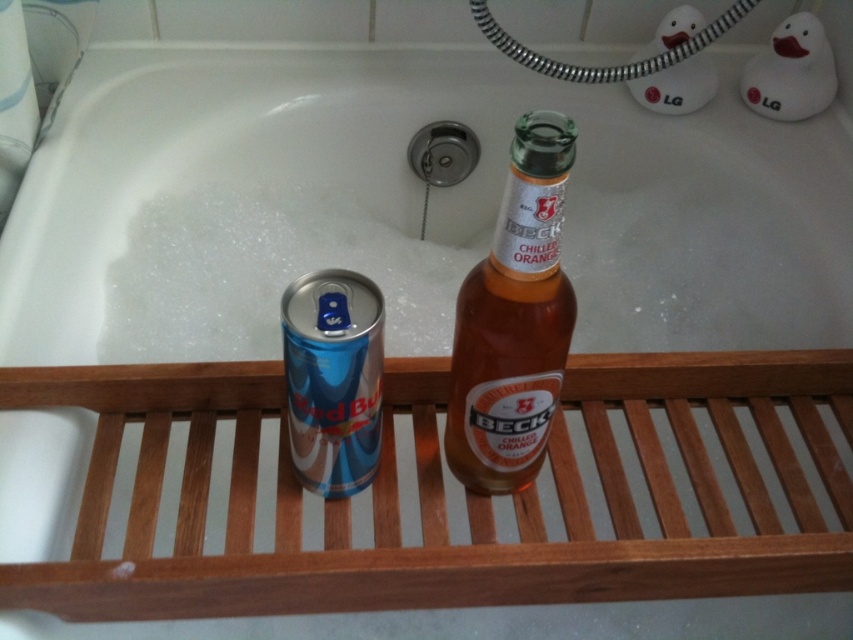
Question: Is white glossy bathtub at upper center positioned behind blue metallic red bull can at left?

Choices:
 (A) no
 (B) yes

Answer: (B)

Question: Considering the relative positions of translucent amber glass bottle at center and blue metallic red bull can at left in the image provided, where is translucent amber glass bottle at center located with respect to blue metallic red bull can at left?

Choices:
 (A) below
 (B) above

Answer: (B)

Question: Does translucent amber glass bottle at center come in front of blue metallic red bull can at left?

Choices:
 (A) no
 (B) yes

Answer: (B)

Question: Which object is the closest to the white glossy bathtub at upper center?

Choices:
 (A) blue metallic red bull can at left
 (B) translucent amber glass bottle at center

Answer: (B)

Question: Estimate the real-world distances between objects in this image. Which object is farther from the translucent amber glass bottle at center?

Choices:
 (A) white glossy bathtub at upper center
 (B) blue metallic red bull can at left

Answer: (A)

Question: Based on their relative distances, which object is nearer to the translucent amber glass bottle at center?

Choices:
 (A) white glossy bathtub at upper center
 (B) blue metallic red bull can at left

Answer: (B)